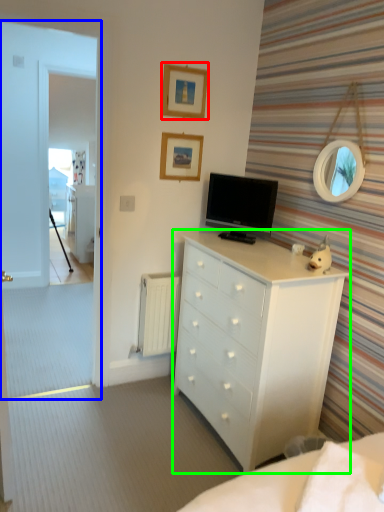
Question: Estimate the real-world distances between objects in this image. Which object is farther from picture frame (highlighted by a red box), glass door (highlighted by a blue box) or chest of drawers (highlighted by a green box)?

Choices:
 (A) glass door
 (B) chest of drawers

Answer: (A)